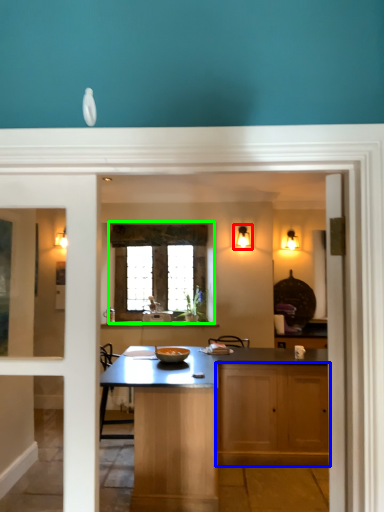
Question: Which object is the farthest from light fixture (highlighted by a red box)? Choose among these: cabinetry (highlighted by a blue box) or window (highlighted by a green box).

Choices:
 (A) cabinetry
 (B) window

Answer: (A)